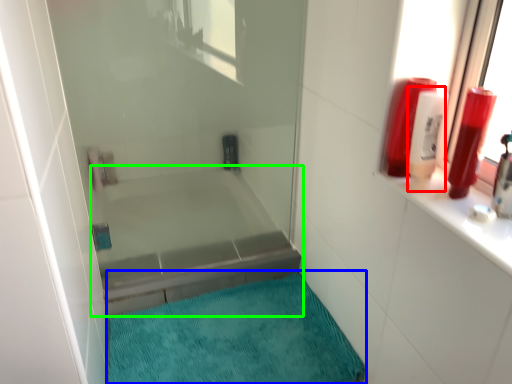
Question: Which object is the farthest from toiletry (highlighted by a red box)? Choose among these: bath mat (highlighted by a blue box) or bathtub (highlighted by a green box).

Choices:
 (A) bath mat
 (B) bathtub

Answer: (B)